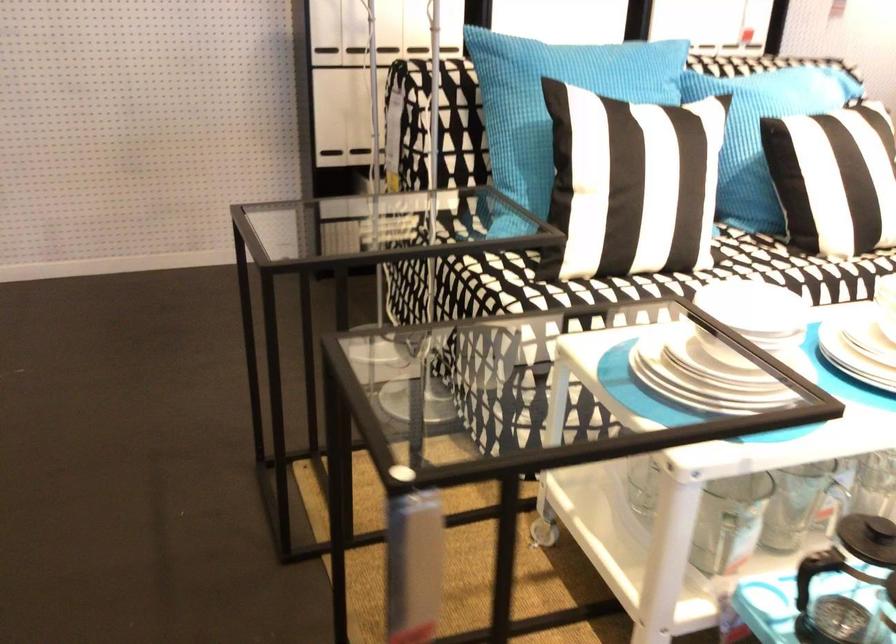
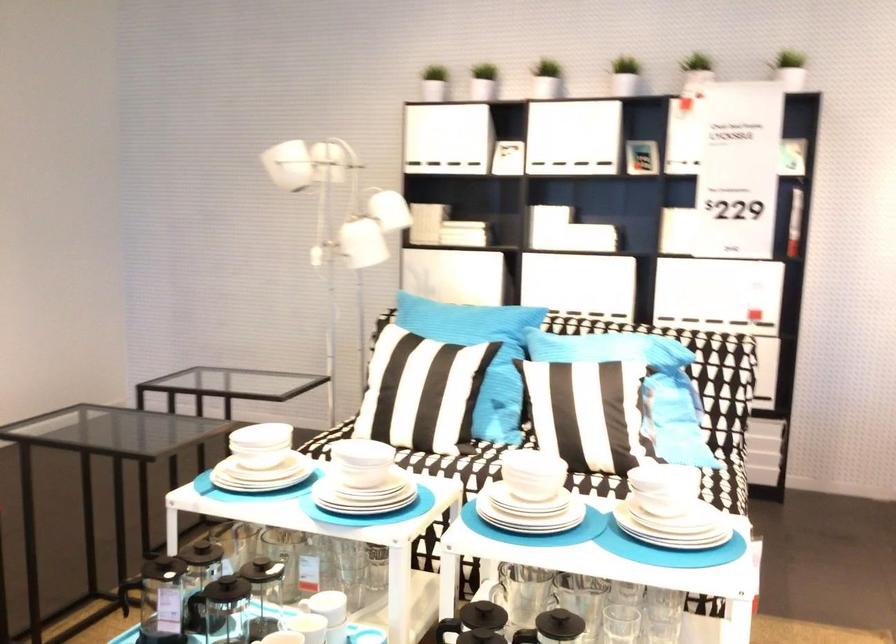
Locate, in the second image, the point that corresponds to [623,84] in the first image.

(467, 324)